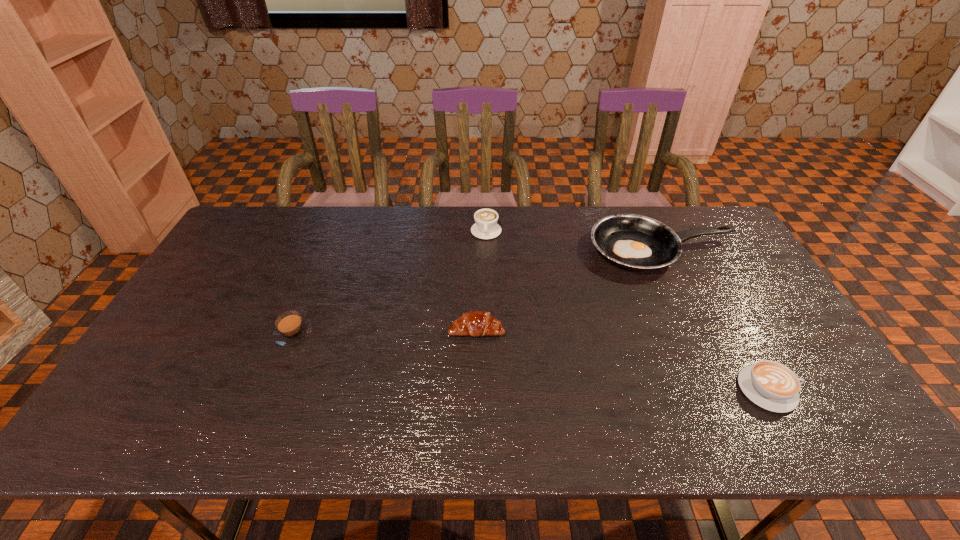
The height and width of the screenshot is (540, 960). I want to click on vacant space at the far edge of the desktop, so click(324, 235).

The image size is (960, 540). In the image, there is a desktop. Find the location of `free space at the near edge`. free space at the near edge is located at coordinates (546, 431).

Where is `vacant space at the left edge of the desktop`? This screenshot has height=540, width=960. vacant space at the left edge of the desktop is located at coordinates (228, 302).

In the image, there is a desktop. Where is `vacant space at the right edge`? vacant space at the right edge is located at coordinates (775, 320).

In the image, there is a desktop. What are the coordinates of `free space at the near left corner` in the screenshot? It's located at (158, 435).

The image size is (960, 540). What are the coordinates of `free space between the leftmost object and the tallest object` in the screenshot? It's located at (390, 282).

Locate an element on the screen. The height and width of the screenshot is (540, 960). unoccupied position between the frying pan and the leftmost cappuccino is located at coordinates (478, 292).

Locate an element on the screen. This screenshot has width=960, height=540. blank region between the crescent roll and the rightmost cappuccino is located at coordinates (622, 359).

At what (x,y) coordinates should I click in order to perform the action: click on free space between the frying pan and the crescent roll. Please return your answer as a coordinate pair (x, y). Looking at the image, I should click on (569, 289).

At what (x,y) coordinates should I click in order to perform the action: click on free space between the frying pan and the second cappuccino from left to right. Please return your answer as a coordinate pair (x, y). The width and height of the screenshot is (960, 540). Looking at the image, I should click on (574, 241).